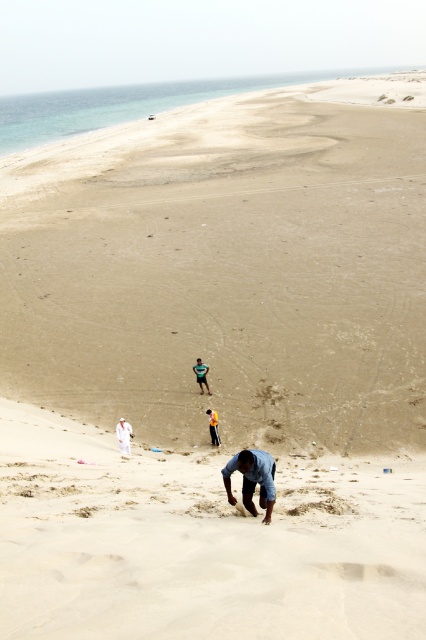
Question: Which is nearer to the blue denim jeans at lower center?

Choices:
 (A) white cotton shirt at center
 (B) yellow fabric person at center
 (C) fine-grained sand at lower center

Answer: (C)

Question: Can you confirm if blue denim jeans at lower center is positioned above white cotton shirt at center?

Choices:
 (A) yes
 (B) no

Answer: (A)

Question: Which of the following is the closest to the observer?

Choices:
 (A) fine-grained sand at lower center
 (B) yellow fabric person at center

Answer: (A)

Question: Which point is farther from the camera taking this photo?

Choices:
 (A) (127, 429)
 (B) (201, 394)
 (C) (244, 484)
 (D) (212, 432)

Answer: (B)

Question: Is blue denim shorts at center to the right of yellow fabric person at center from the viewer's perspective?

Choices:
 (A) yes
 (B) no

Answer: (B)

Question: Does fine-grained sand at lower center have a greater width compared to blue denim shorts at center?

Choices:
 (A) no
 (B) yes

Answer: (B)